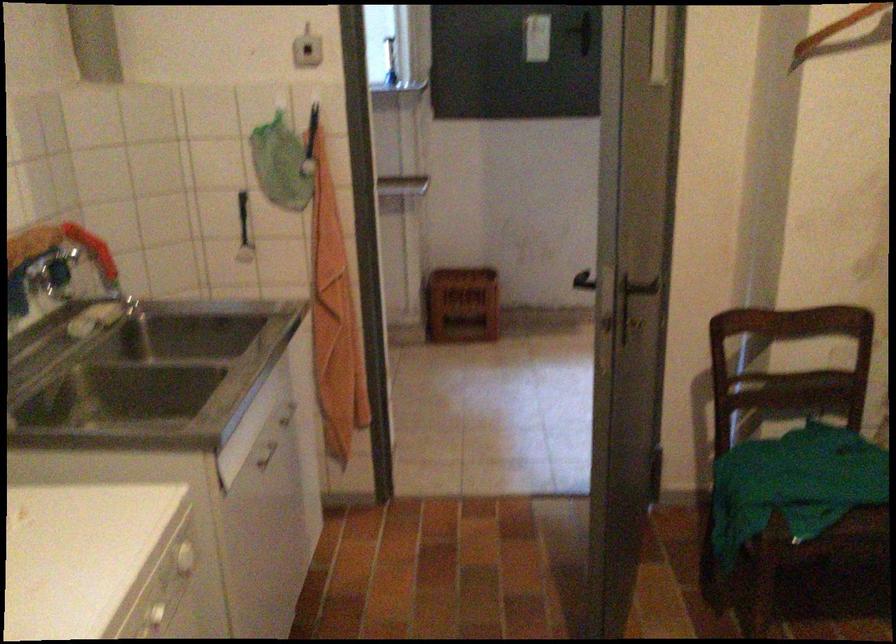
I want to click on chair sitting surface, so click(x=806, y=483).